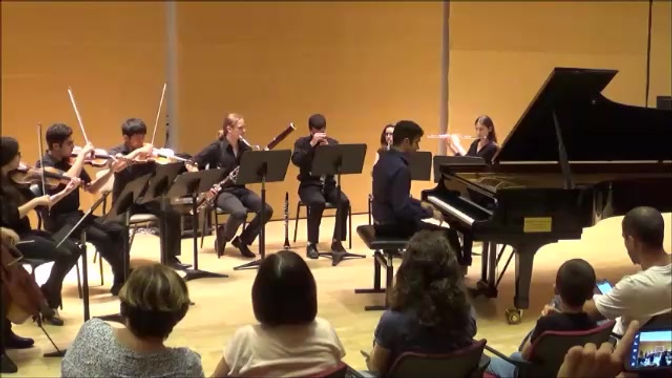
Where is `black bench`? The width and height of the screenshot is (672, 378). black bench is located at coordinates (386, 241).